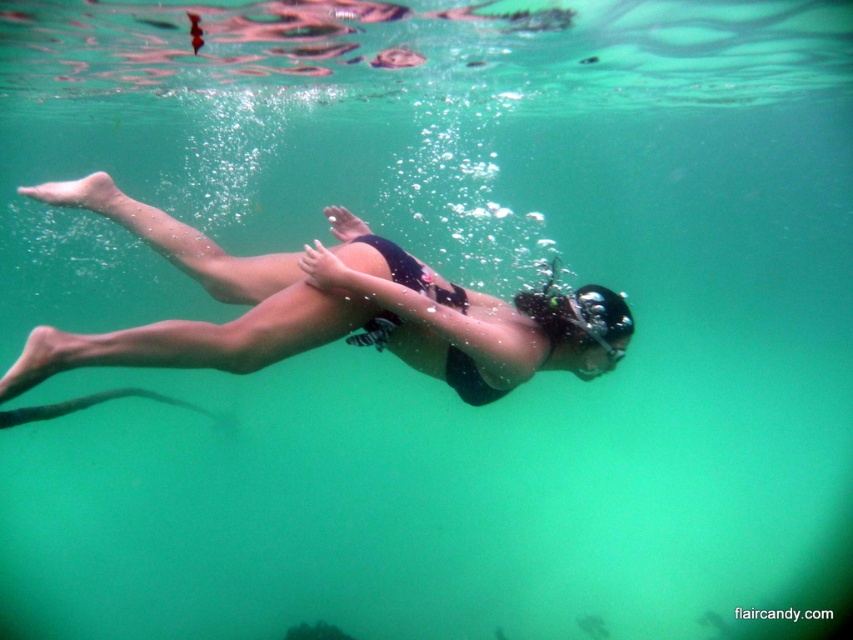
You are a lifeguard observing the underwater scene. You notice the black matte swimsuit at center and the transparent rubber goggles at center. Which object is positioned more to the left?

The black matte swimsuit at center is positioned more to the left than the transparent rubber goggles at center.

You are a swimmer in the underwater scene. You notice two points in the water. The first point is at coordinates point (390, 296), and the second is at point (561, 308). Which point is closer to you as you face forward?

Point (390, 296) is in front of point (561, 308), so the first point is closer to you as you face forward.